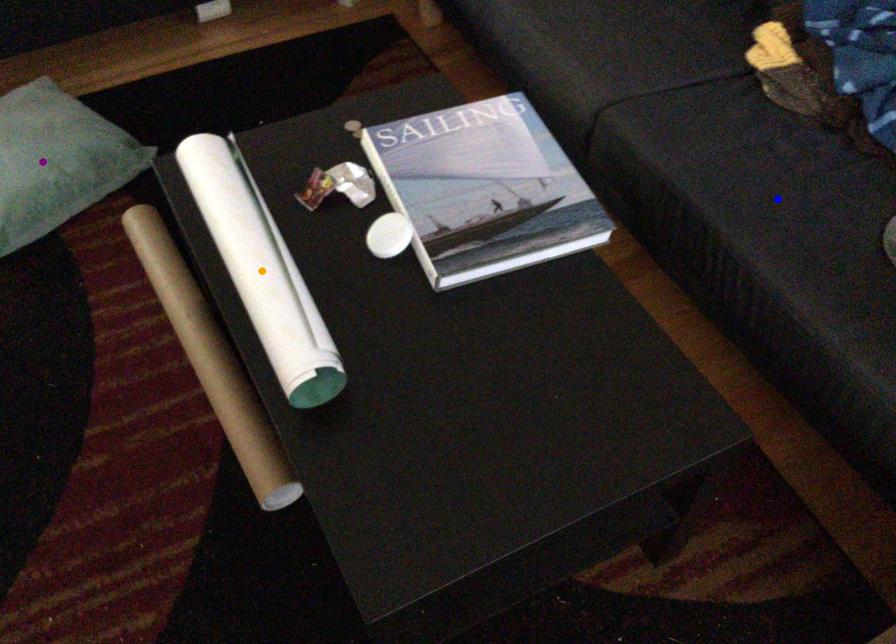
Order these from nearest to farthest:
orange point, blue point, purple point

purple point, blue point, orange point